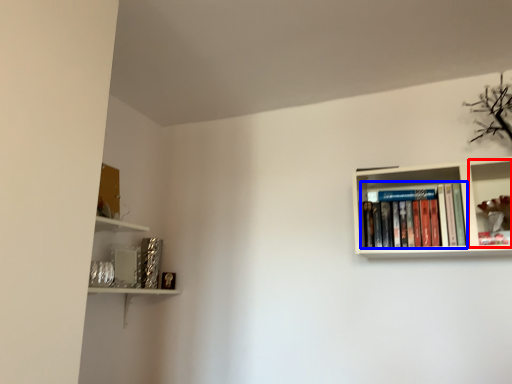
Question: Which object appears farthest to the camera in this image, shelf (highlighted by a red box) or book (highlighted by a blue box)?

Choices:
 (A) shelf
 (B) book

Answer: (B)